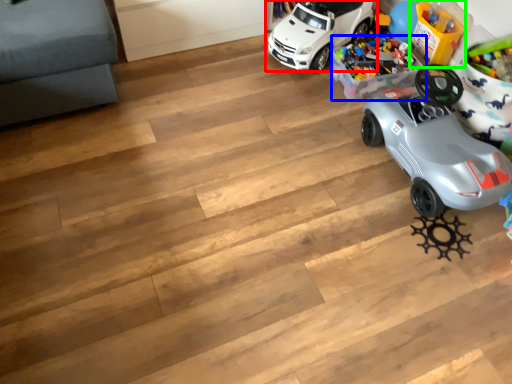
Question: Considering the real-world distances, which object is closest to car (highlighted by a red box)? toy (highlighted by a blue box) or toy (highlighted by a green box).

Choices:
 (A) toy
 (B) toy

Answer: (A)